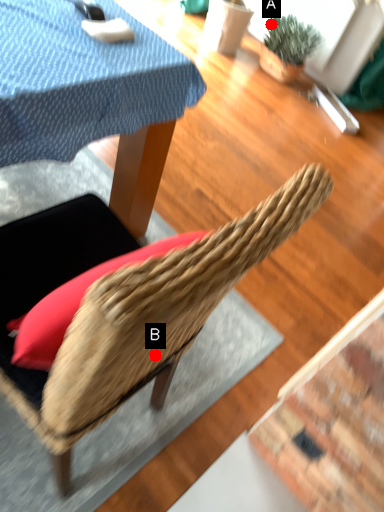
Question: Two points are circled on the image, labeled by A and B beside each circle. Among these points, which one is farthest from the camera?

Choices:
 (A) A is further
 (B) B is further

Answer: (A)